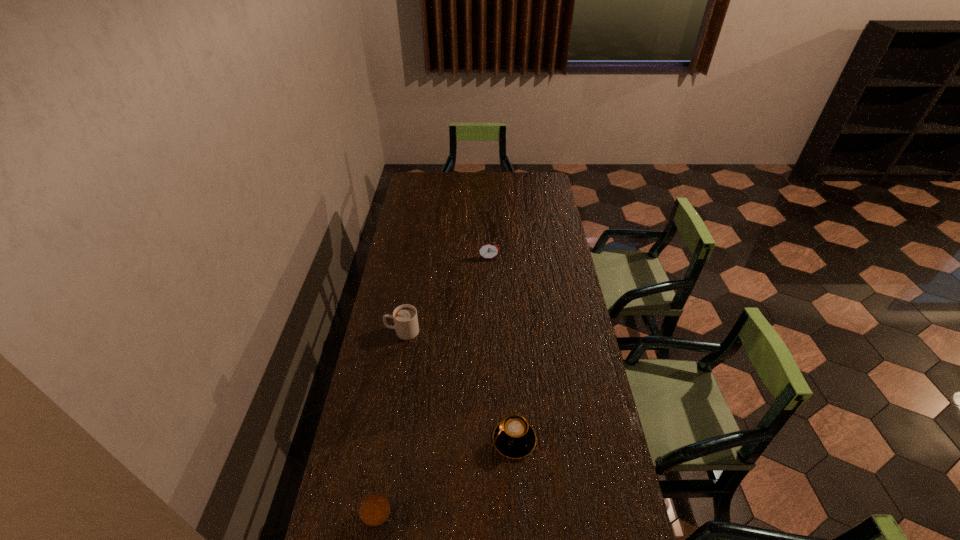
Find the location of a particular element. Image resolution: width=960 pixels, height=540 pixels. free space at the right edge of the desktop is located at coordinates (555, 207).

Where is `free area in between the farthest object and the farthest cappuccino`? free area in between the farthest object and the farthest cappuccino is located at coordinates (445, 295).

Identify the location of empty space that is in between the alarm clock and the tallest cappuccino. The height and width of the screenshot is (540, 960). (445, 295).

This screenshot has width=960, height=540. I want to click on empty space between the tallest cappuccino and the farthest object, so point(445,295).

Locate an element on the screen. This screenshot has height=540, width=960. the second closest object to the tallest cappuccino is located at coordinates (488, 250).

Point out which object is positioned as the nearest to the third farthest object. Please provide its 2D coordinates. Your answer should be formatted as a tuple, i.e. [(x, y)], where the tuple contains the x and y coordinates of a point satisfying the conditions above.

[(377, 516)]

Find the location of a particular element. The width and height of the screenshot is (960, 540). the closest cappuccino to the nearest cappuccino is located at coordinates (514, 438).

Identify which cappuccino is the second closest to the alarm clock. Please provide its 2D coordinates. Your answer should be formatted as a tuple, i.e. [(x, y)], where the tuple contains the x and y coordinates of a point satisfying the conditions above.

[(514, 438)]

What are the coordinates of `vacant region that satisfies the following two spatial constraints: 1. on the side with the handle of the second farthest object; 2. on the left side of the second nearest object` in the screenshot? It's located at (384, 440).

Locate an element on the screen. vacant point that satisfies the following two spatial constraints: 1. on the clock face of the second farthest cappuccino; 2. on the left side of the alarm clock is located at coordinates (492, 440).